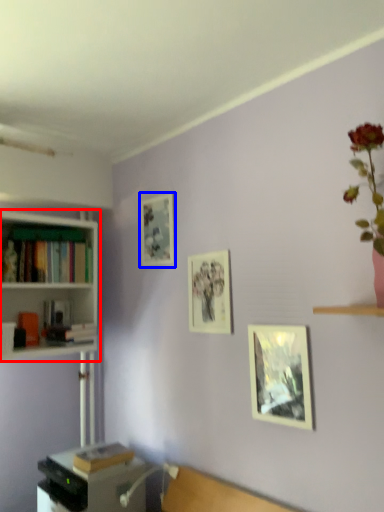
Question: Which object is further to the camera taking this photo, bookcase (highlighted by a red box) or picture frame (highlighted by a blue box)?

Choices:
 (A) bookcase
 (B) picture frame

Answer: (B)